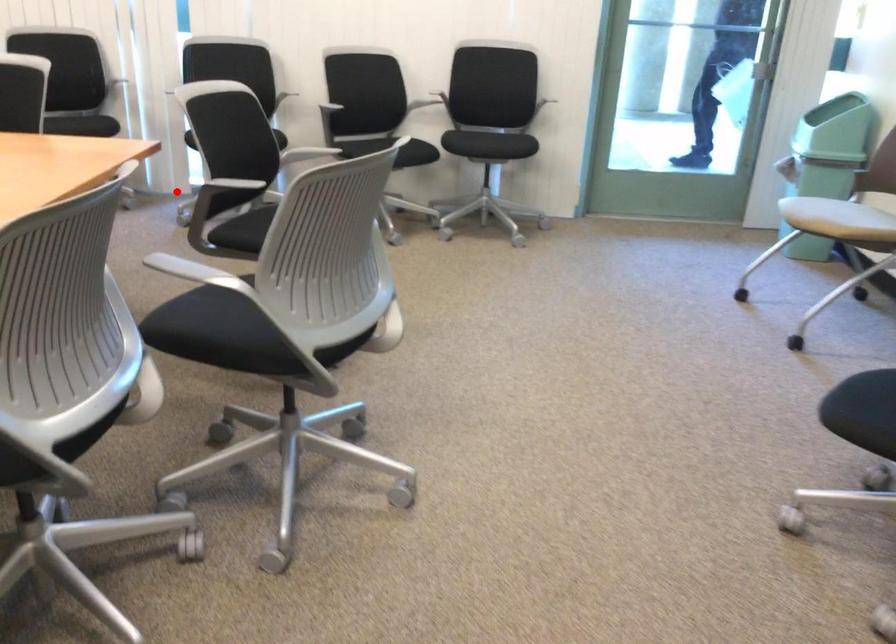
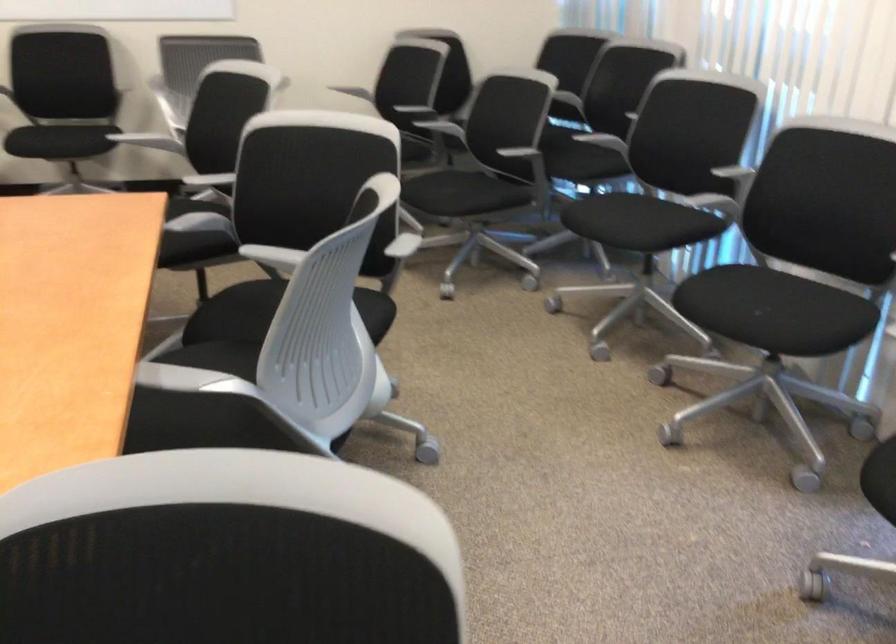
Find the pixel in the second image that matches the highlighted location in the first image.

(858, 527)